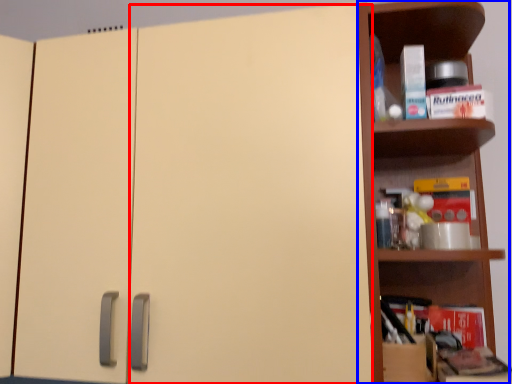
Question: Among these objects, which one is farthest to the camera, door (highlighted by a red box) or shelf (highlighted by a blue box)?

Choices:
 (A) door
 (B) shelf

Answer: (B)